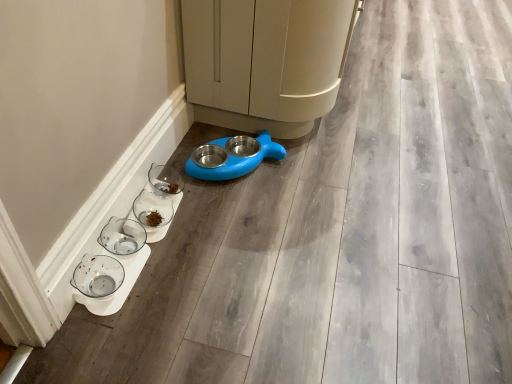
Locate an element on the screen. free space in front of blue plastic bowl at lower center is located at coordinates (337, 222).